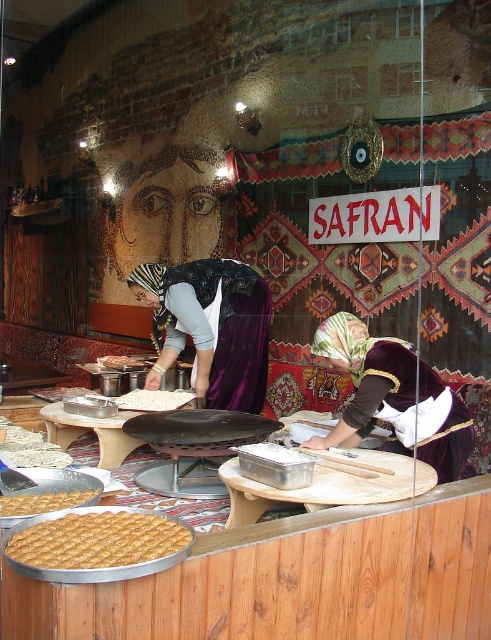
Question: Does velvet fabric headscarf at center lie behind white flour at center?

Choices:
 (A) no
 (B) yes

Answer: (B)

Question: Is velvet fabric headscarf at center further to camera compared to white matte flatbread at center?

Choices:
 (A) yes
 (B) no

Answer: (B)

Question: Estimate the real-world distances between objects in this image. Which object is closer to the golden crispy pastry at lower left?

Choices:
 (A) white flour at center
 (B) velvet brown dress at center
 (C) velvet fabric headscarf at center

Answer: (A)

Question: Is golden crispy pastry at center thinner than golden crispy pastry at lower left?

Choices:
 (A) no
 (B) yes

Answer: (A)

Question: Which object appears farthest from the camera in this image?

Choices:
 (A) velvet fabric headscarf at center
 (B) velvet brown dress at center
 (C) white matte flatbread at center

Answer: (C)

Question: Which is nearer to the white matte flatbread at center?

Choices:
 (A) velvet fabric headscarf at center
 (B) golden crispy pastry at center
 (C) golden crispy pastry at lower left
 (D) velvet brown dress at center

Answer: (A)